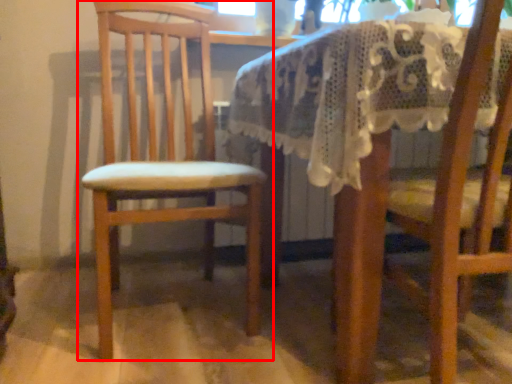
Question: From the image, what is the correct spatial relationship of chair (annotated by the red box) in relation to chair?

Choices:
 (A) left
 (B) right

Answer: (A)